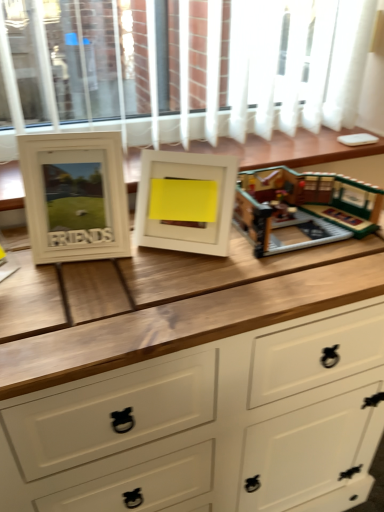
How much space does white matte picture frame at left, the 2th picture frame positioned from the right, occupy horizontally?

white matte picture frame at left, the 2th picture frame positioned from the right, is 14.26 centimeters in width.

What do you see at coordinates (209, 425) in the screenshot? I see `white wood chest of drawers at center` at bounding box center [209, 425].

This screenshot has width=384, height=512. What are the coordinates of `white matte picture frame at left, the first picture frame when ordered from left to right` in the screenshot? It's located at (75, 196).

In the scene shown: Could you tell me if white matte picture frame at left, the 2th picture frame positioned from the right, is facing brick-like lego set at center?

No, white matte picture frame at left, the 2th picture frame positioned from the right, is not turned towards brick-like lego set at center.

Find the location of `the 2nd picture frame in front when counting from the brick-like lego set at center`. the 2nd picture frame in front when counting from the brick-like lego set at center is located at coordinates (75, 196).

Is white matte picture frame at left, the 2th picture frame positioned from the right, not close to brick-like lego set at center?

They are positioned close to each other.

Looking at this image, considering the relative positions of white matte picture frame at left, the 2th picture frame positioned from the right, and brick-like lego set at center in the image provided, is white matte picture frame at left, the 2th picture frame positioned from the right, to the left or to the right of brick-like lego set at center?

From the image, it's evident that white matte picture frame at left, the 2th picture frame positioned from the right, is to the left of brick-like lego set at center.

Can we say white matte picture frame at center, which ranks as the second picture frame in left-to-right order, lies outside brick-like lego set at center?

→ white matte picture frame at center, which ranks as the second picture frame in left-to-right order, lies outside brick-like lego set at center's area.

From the image's perspective, is white matte picture frame at center, which ranks as the second picture frame in left-to-right order, beneath brick-like lego set at center?

Indeed, from the image's perspective, white matte picture frame at center, which ranks as the second picture frame in left-to-right order, is shown beneath brick-like lego set at center.

Which object is thinner, white matte picture frame at center, which is the 1th picture frame in right-to-left order, or brick-like lego set at center?

white matte picture frame at center, which is the 1th picture frame in right-to-left order.

From a real-world perspective, between white matte picture frame at center, which is the 1th picture frame in right-to-left order, and brick-like lego set at center, who is vertically lower?

From a 3D spatial view, brick-like lego set at center is below.

From the image's perspective, is brick-like lego set at center located above or below white matte picture frame at center, which is the 1th picture frame in right-to-left order?

brick-like lego set at center is situated higher than white matte picture frame at center, which is the 1th picture frame in right-to-left order, in the image.

From the picture: In the image, is brick-like lego set at center on the left side or the right side of white matte picture frame at center, which ranks as the second picture frame in left-to-right order?

brick-like lego set at center is to the right of white matte picture frame at center, which ranks as the second picture frame in left-to-right order.

Based on the photo, which point is more forward, (319, 238) or (203, 164)?

The point (203, 164) is closer.

Considering the sizes of objects white wood chest of drawers at center and white matte picture frame at left, the 2th picture frame positioned from the right, in the image provided, who is taller, white wood chest of drawers at center or white matte picture frame at left, the 2th picture frame positioned from the right,?

white wood chest of drawers at center is taller.

Looking at this image, considering the relative positions of white wood chest of drawers at center and white matte picture frame at left, the 2th picture frame positioned from the right, in the image provided, is white wood chest of drawers at center to the left or to the right of white matte picture frame at left, the 2th picture frame positioned from the right,?

From the image, it's evident that white wood chest of drawers at center is to the right of white matte picture frame at left, the 2th picture frame positioned from the right.

Is white wood chest of drawers at center further to the viewer compared to white matte picture frame at left, the first picture frame when ordered from left to right?

That is False.

Locate an element on the screen. This screenshot has width=384, height=512. chest of drawers located on the right of white matte picture frame at left, the first picture frame when ordered from left to right is located at coordinates (209, 425).

Considering the positions of point (247, 469) and point (298, 187), is point (247, 469) closer or farther from the camera than point (298, 187)?

Point (247, 469) is farther from the camera than point (298, 187).

Could brick-like lego set at center be considered to be inside white wood chest of drawers at center?

No.

Is white wood chest of drawers at center far from brick-like lego set at center?

No, white wood chest of drawers at center is not far from brick-like lego set at center.

From the image's perspective, who appears lower, white wood chest of drawers at center or brick-like lego set at center?

white wood chest of drawers at center is shown below in the image.

I want to click on toy located on the right of white wood chest of drawers at center, so click(303, 208).

Which object is thinner, brick-like lego set at center or white wood chest of drawers at center?

With smaller width is brick-like lego set at center.

Is brick-like lego set at center not close to white wood chest of drawers at center?

That's not correct — brick-like lego set at center is a little close to white wood chest of drawers at center.

Which of these two, brick-like lego set at center or white wood chest of drawers at center, stands taller?

Standing taller between the two is white wood chest of drawers at center.

Is white wooden buffet at center inside or outside of white matte picture frame at center, which is the 1th picture frame in right-to-left order?

white wooden buffet at center is outside white matte picture frame at center, which is the 1th picture frame in right-to-left order.

Consider the image. From the image's perspective, is white wooden buffet at center above white matte picture frame at center, which ranks as the second picture frame in left-to-right order?

Yes, from the image's perspective, white wooden buffet at center is over white matte picture frame at center, which ranks as the second picture frame in left-to-right order.

Considering the sizes of objects white wooden buffet at center and white matte picture frame at center, which ranks as the second picture frame in left-to-right order, in the image provided, who is shorter, white wooden buffet at center or white matte picture frame at center, which ranks as the second picture frame in left-to-right order,?

white wooden buffet at center.

The height and width of the screenshot is (512, 384). Identify the location of picture frame that is the 2nd one when counting forward from the brick-like lego set at center. (75, 196).

I want to click on toy that is behind the white matte picture frame at center, which is the 1th picture frame in right-to-left order, so click(303, 208).

Estimate the real-world distances between objects in this image. Which object is closer to brick-like lego set at center, white wooden buffet at center or white matte picture frame at left, the 2th picture frame positioned from the right?

white wooden buffet at center lies closer to brick-like lego set at center than the other object.

Considering their positions, is white matte picture frame at left, the first picture frame when ordered from left to right, positioned further to white wooden buffet at center than white wood chest of drawers at center?

white wood chest of drawers at center.

Estimate the real-world distances between objects in this image. Which object is further from white wooden buffet at center, white matte picture frame at left, the 2th picture frame positioned from the right, or white matte picture frame at center, which is the 1th picture frame in right-to-left order?

Among the two, white matte picture frame at left, the 2th picture frame positioned from the right, is located further to white wooden buffet at center.

Which object lies nearer to the anchor point white wooden buffet at center, white wood chest of drawers at center or white matte picture frame at left, the 2th picture frame positioned from the right?

Based on the image, white matte picture frame at left, the 2th picture frame positioned from the right, appears to be nearer to white wooden buffet at center.

From the image, which object appears to be nearer to white matte picture frame at center, which is the 1th picture frame in right-to-left order, white matte picture frame at left, the 2th picture frame positioned from the right, or white wooden buffet at center?

The object closer to white matte picture frame at center, which is the 1th picture frame in right-to-left order, is white matte picture frame at left, the 2th picture frame positioned from the right.

Considering their positions, is white matte picture frame at center, which ranks as the second picture frame in left-to-right order, positioned further to white matte picture frame at left, the 2th picture frame positioned from the right, than brick-like lego set at center?

brick-like lego set at center.

When comparing their distances from white wood chest of drawers at center, does white wooden buffet at center or brick-like lego set at center seem closer?

brick-like lego set at center is positioned closer to the anchor white wood chest of drawers at center.

Looking at the image, which one is located further to white wood chest of drawers at center, white wooden buffet at center or white matte picture frame at left, the first picture frame when ordered from left to right?

white wooden buffet at center lies further to white wood chest of drawers at center than the other object.

Find the location of a particular element. The height and width of the screenshot is (512, 384). toy between white matte picture frame at left, the 2th picture frame positioned from the right, and white wood chest of drawers at center in the up-down direction is located at coordinates 303,208.

The height and width of the screenshot is (512, 384). I want to click on picture frame between white matte picture frame at left, the 2th picture frame positioned from the right, and white wood chest of drawers at center vertically, so click(185, 202).

Locate an element on the screen. picture frame situated between white matte picture frame at left, the 2th picture frame positioned from the right, and brick-like lego set at center from left to right is located at coordinates (185, 202).

Locate an element on the screen. picture frame situated between white matte picture frame at left, the 2th picture frame positioned from the right, and white wooden buffet at center from left to right is located at coordinates (185, 202).